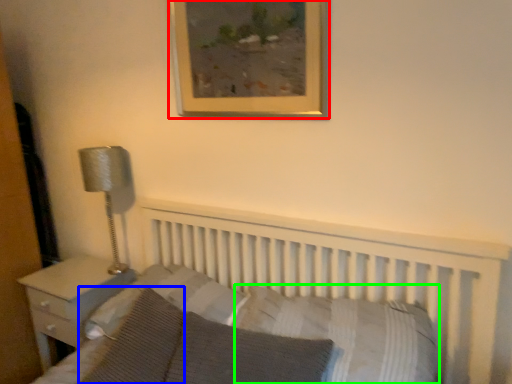
Question: Considering the real-world distances, which object is farthest from picture frame (highlighted by a red box)? pillow (highlighted by a blue box) or pillow (highlighted by a green box)?

Choices:
 (A) pillow
 (B) pillow

Answer: (A)